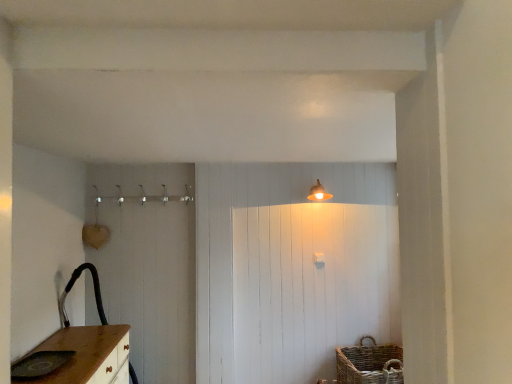
What are the coordinates of `free spot above matte gray sink at lower left (from a real-world perspective)` in the screenshot? It's located at (38, 360).